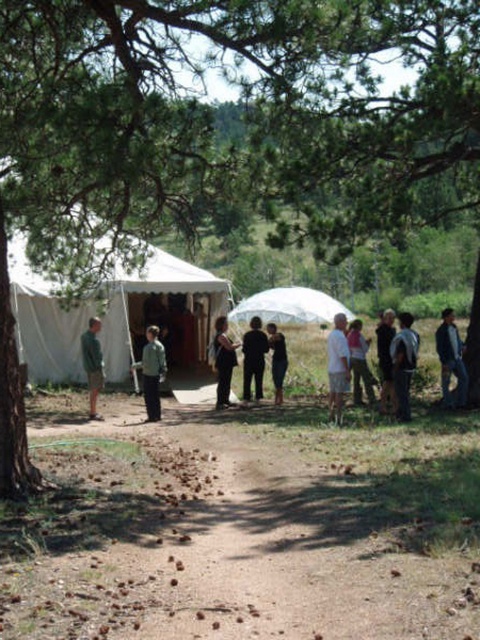
Question: Based on their relative distances, which object is farther from the dark gray fabric jacket at center?

Choices:
 (A) black cotton pants at center
 (B) dirt path at center

Answer: (B)

Question: Can you confirm if white canvas tent at center is positioned to the right of dark gray sweater at lower right?

Choices:
 (A) yes
 (B) no

Answer: (B)

Question: Can you confirm if dark gray sweater at lower right is thinner than dark brown leather jacket at lower right?

Choices:
 (A) yes
 (B) no

Answer: (A)

Question: Which object is positioned farthest from the green fabric tent at left?

Choices:
 (A) black fabric dress at center
 (B) dark brown leather jacket at center
 (C) brown leather jacket at right

Answer: (C)

Question: Can you confirm if black cotton pants at center is positioned to the left of green fabric tent at left?

Choices:
 (A) no
 (B) yes

Answer: (A)

Question: Among these points, which one is nearest to the camera?

Choices:
 (A) (215, 540)
 (B) (277, 365)
 (C) (155, 285)
 (D) (352, 321)

Answer: (A)